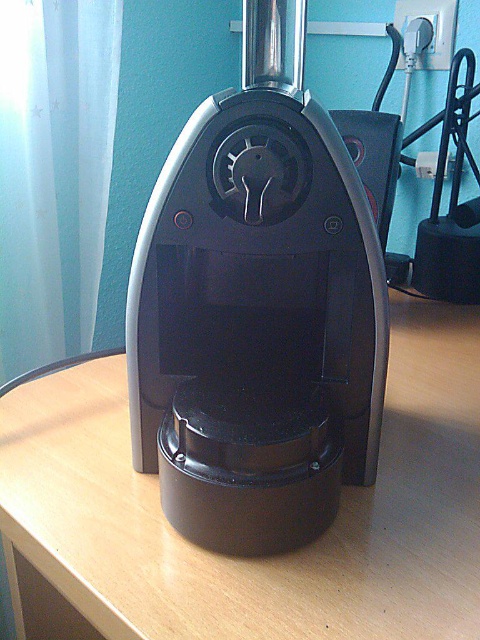
You are standing 1 meter away from the black plastic coffee machine at center. Can you reach it without moving your feet?

The black plastic coffee machine at center is 48.02 centimeters away from the camera, so if you are standing 1 meter away, you might need to stretch or move closer to reach it.

You are setting up a coffee machine and need to place it on the wooden table at center. Where should you place the black plastic coffee machine at center so that it aligns with the existing setup shown in the image?

The black plastic coffee machine at center should be placed on the left side of the wooden table at center as shown in the image.

You are setting up a new coffee machine and need to ensure it fits on your desk. The desk has a rectangular space available at point coordinates between 0.4 and 0.6 on both axes. Does the black plastic coffee machine at center fit within this area?

The black plastic coffee machine at center is located at point coordinates exactly at 0.489 on the x and 0.535 on the y, which falls within the desk space between 0.4 and 0.6 on both axes. Therefore, it fits perfectly within the designated area.